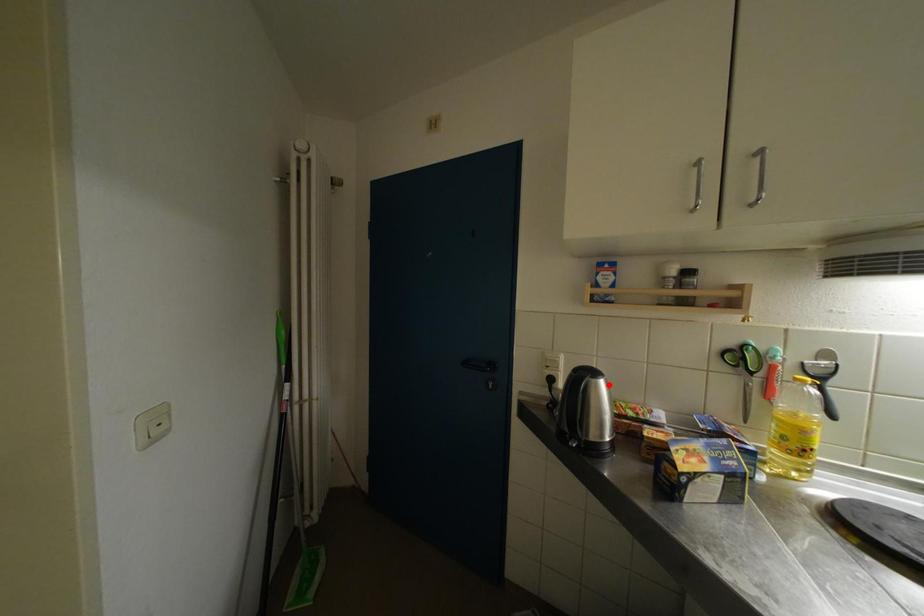
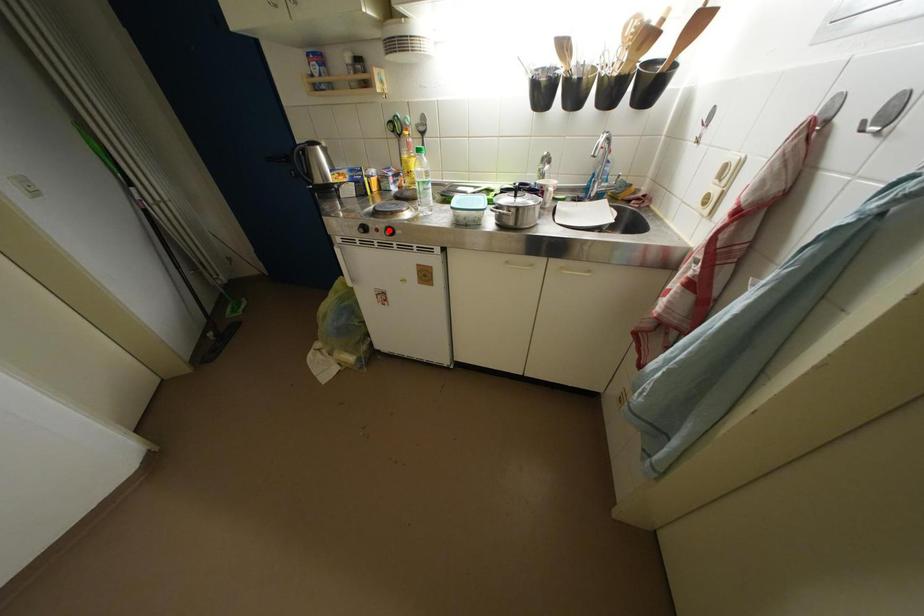
I am providing you with two images of the same scene from different viewpoints. A red point is marked on the first image and another point is marked on the second image. Do the highlighted points in image1 and image2 indicate the same real-world spot?

No